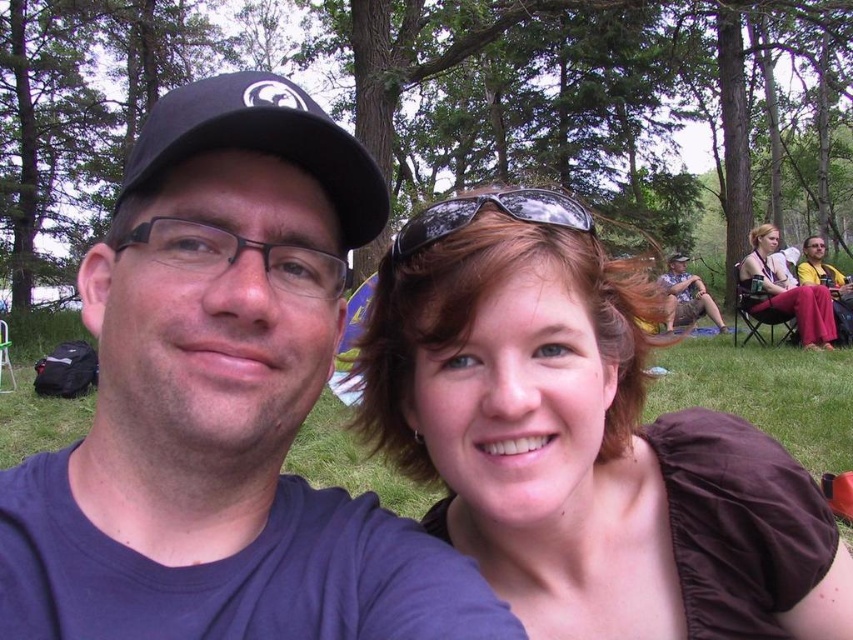
Who is taller, matte black cap at upper left or matte yellow dress at center?

matte yellow dress at center

Does point (216, 576) come in front of point (764, 276)?

That is True.

Does point (192, 481) come behind point (747, 269)?

No, (192, 481) is closer to viewer.

Image resolution: width=853 pixels, height=640 pixels. I want to click on matte black cap at upper left, so click(222, 404).

Who is more forward, (785, 296) or (811, 248)?

Point (785, 296) is more forward.

Where is `matte yellow dress at center`? This screenshot has width=853, height=640. matte yellow dress at center is located at coordinates (785, 291).

Is black matte baseball cap at upper left shorter than brown leather jacket at upper right?

Yes.

Does black matte baseball cap at upper left have a greater height compared to brown leather jacket at upper right?

No, black matte baseball cap at upper left is not taller than brown leather jacket at upper right.

Between point (306, 116) and point (811, 260), which one is positioned behind?

The point (811, 260) is behind.

Find the location of `black matte baseball cap at upper left`. black matte baseball cap at upper left is located at coordinates (260, 141).